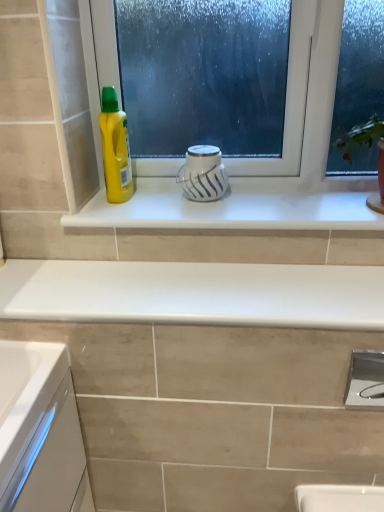
What are the coordinates of `spots to the right of yellow plastic bottle at left` in the screenshot? It's located at (165, 206).